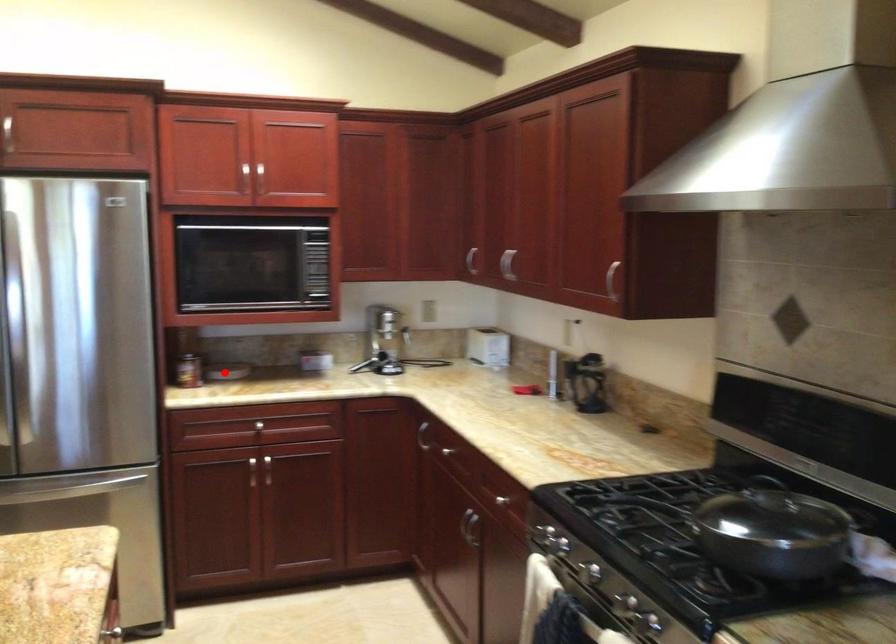
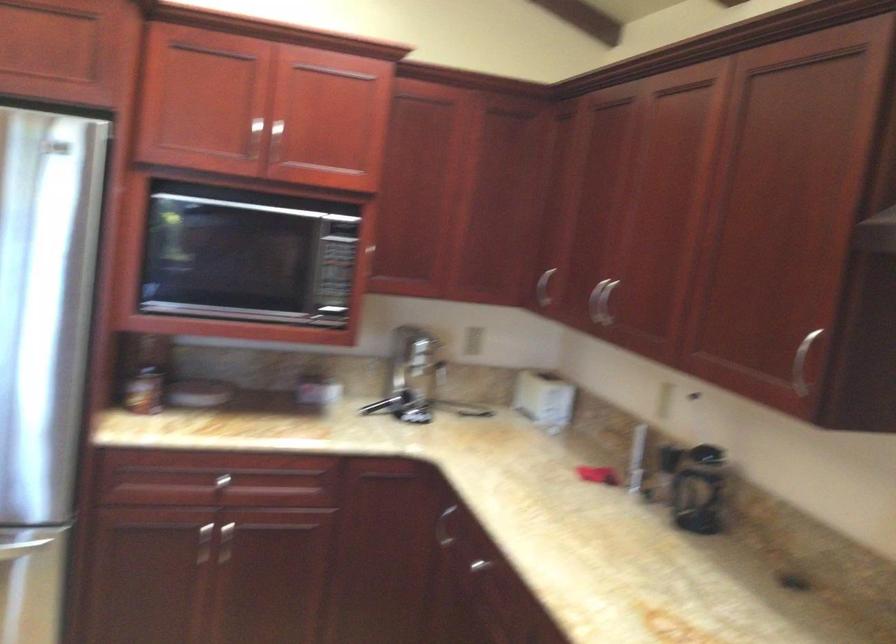
Locate, in the second image, the point that corresponds to the highlighted location in the first image.

(197, 393)